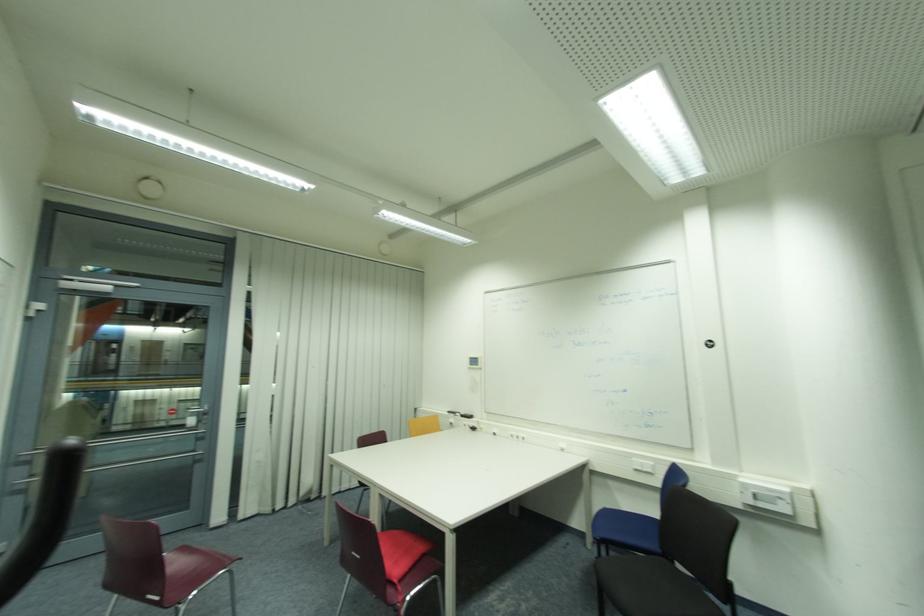
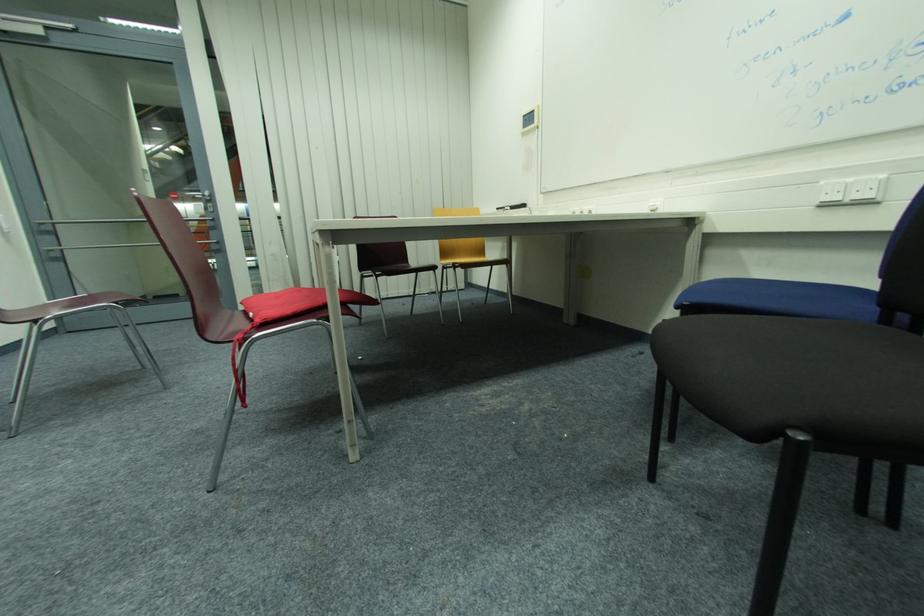
Which direction would the cameraman need to move to produce the second image?

The cameraman walked toward right, forward.